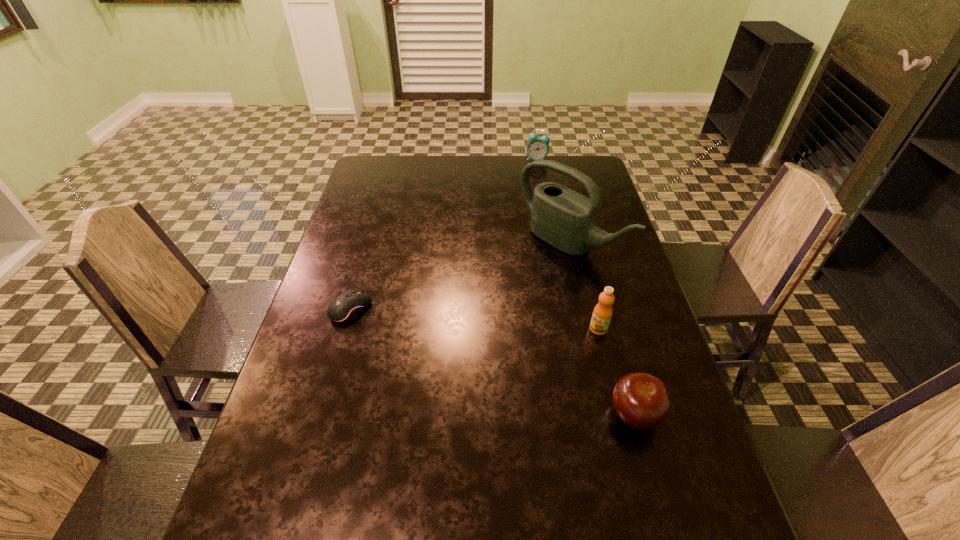
Identify the location of apple that is at the right edge. (642, 401).

At what (x,y) coordinates should I click in order to perform the action: click on watering can at the right edge. Please return your answer as a coordinate pair (x, y). Looking at the image, I should click on [x=565, y=219].

Locate an element on the screen. orange juice located at the right edge is located at coordinates (602, 313).

The height and width of the screenshot is (540, 960). I want to click on free space at the far edge, so click(516, 179).

Where is `vacant area at the left edge of the desktop`? vacant area at the left edge of the desktop is located at coordinates (370, 259).

At what (x,y) coordinates should I click in order to perform the action: click on blank space at the right edge. Please return your answer as a coordinate pair (x, y). Looking at the image, I should click on (624, 281).

Image resolution: width=960 pixels, height=540 pixels. I want to click on empty space that is in between the fourth shortest object and the second farthest object, so click(x=584, y=287).

Image resolution: width=960 pixels, height=540 pixels. I want to click on free space that is in between the leftmost object and the watering can, so click(x=460, y=276).

Locate an element on the screen. The image size is (960, 540). empty space between the leftmost object and the farthest object is located at coordinates (444, 234).

Find the location of a particular element. The height and width of the screenshot is (540, 960). object that is the third nearest to the apple is located at coordinates (347, 306).